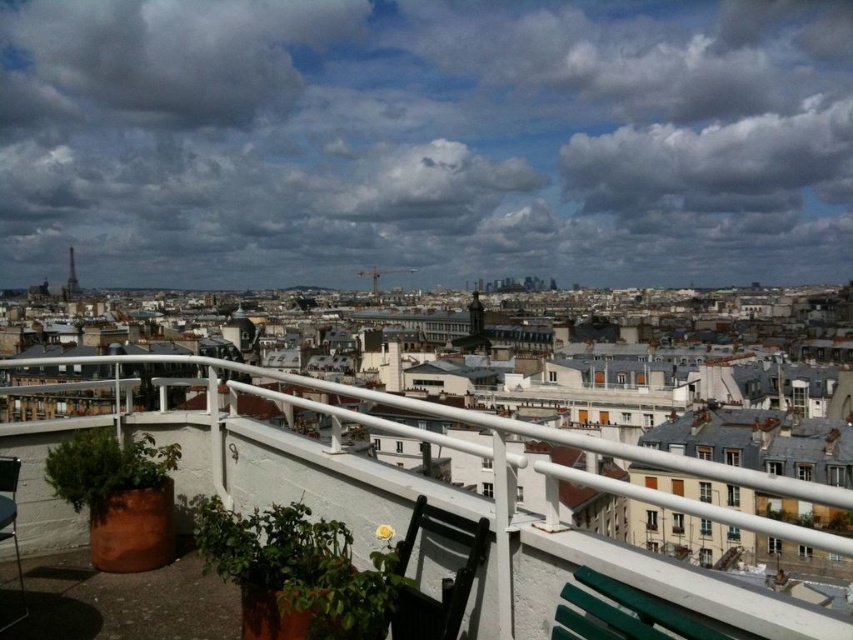
Describe the element at coordinates (440, 579) in the screenshot. The image size is (853, 640). I see `black plastic chair at lower center` at that location.

Who is higher up, black plastic chair at lower center or green plastic chair at lower right?

black plastic chair at lower center is higher up.

Is point (483, 545) farther from viewer compared to point (585, 582)?

Yes, point (483, 545) is behind point (585, 582).

The image size is (853, 640). I want to click on black plastic chair at lower center, so click(440, 579).

Is point (294, 461) closer to viewer compared to point (19, 586)?

No, (294, 461) is behind (19, 586).

Who is positioned more to the right, white metal railing at upper center or metallic silver chair at lower left?

white metal railing at upper center is more to the right.

This screenshot has height=640, width=853. In order to click on white metal railing at upper center in this screenshot , I will do `click(467, 506)`.

Where is `white metal railing at upper center`? white metal railing at upper center is located at coordinates (467, 506).

Where is `white metal railing at upper center`? The image size is (853, 640). white metal railing at upper center is located at coordinates (467, 506).